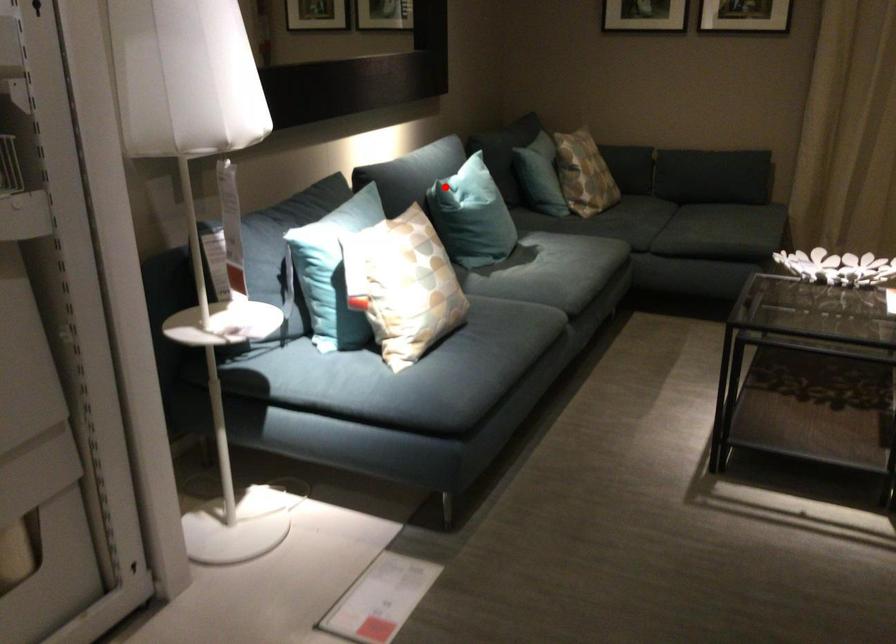
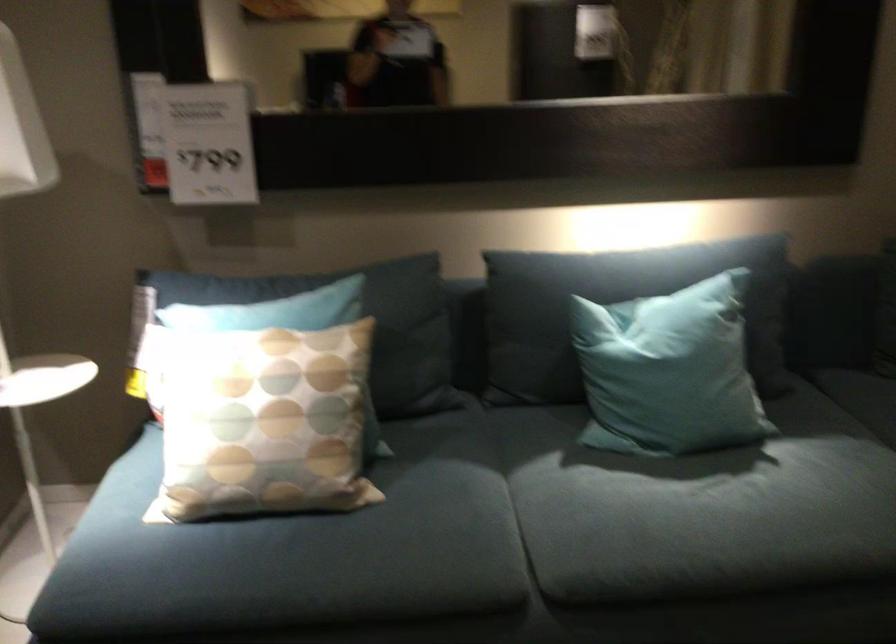
Question: A red point is marked in image1. In image2, is the corresponding 3D point closer to the camera or farther? Reply with the corresponding letter.

Choices:
 (A) The corresponding 3D point is closer.
 (B) The corresponding 3D point is farther.

Answer: (A)